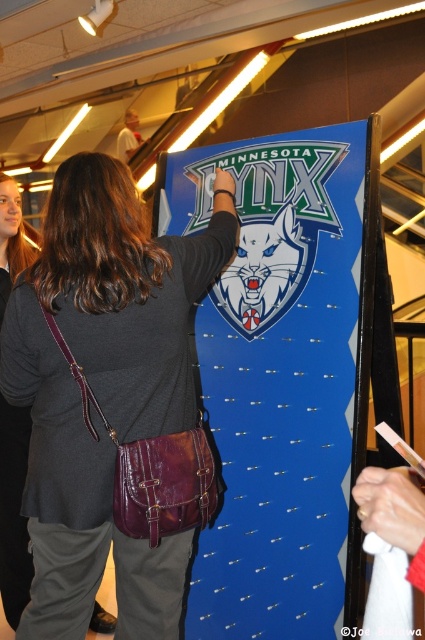
Question: Which object is farther from the camera taking this photo?

Choices:
 (A) blue glossy poster at center
 (B) leather crossbody bag at center

Answer: (A)

Question: Is blue glossy poster at center to the right of leather crossbody bag at center from the viewer's perspective?

Choices:
 (A) no
 (B) yes

Answer: (B)

Question: Does blue glossy poster at center appear on the right side of leather crossbody bag at center?

Choices:
 (A) no
 (B) yes

Answer: (B)

Question: Which point is closer to the camera?

Choices:
 (A) leather crossbody bag at center
 (B) blue glossy poster at center

Answer: (A)

Question: Can you confirm if blue glossy poster at center is smaller than leather crossbody bag at center?

Choices:
 (A) yes
 (B) no

Answer: (B)

Question: Which of the following is the closest to the observer?

Choices:
 (A) leather crossbody bag at center
 (B) blue glossy poster at center

Answer: (A)